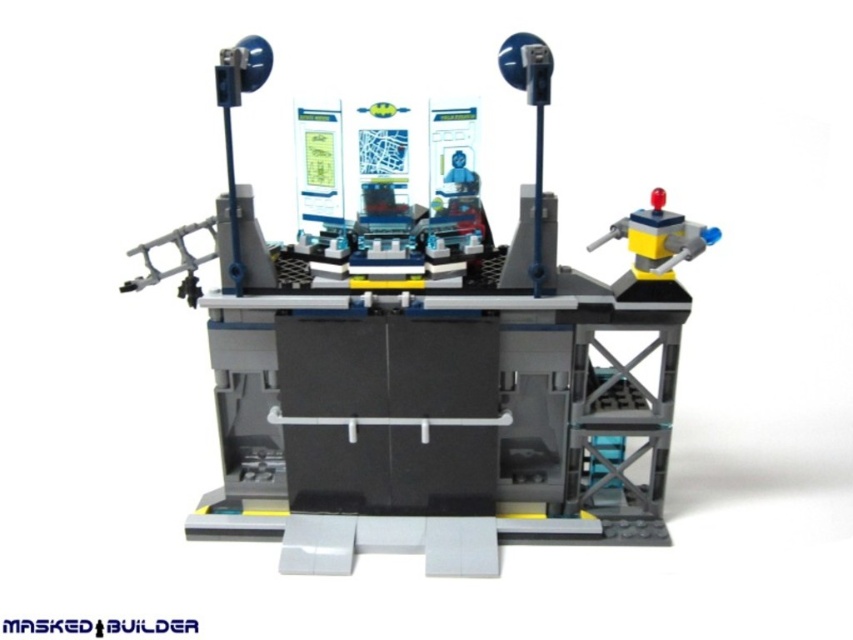
Question: Is matte gray robot at upper right wider than yellow plastic robot at upper right?

Choices:
 (A) yes
 (B) no

Answer: (A)

Question: Which object is farther from the camera taking this photo?

Choices:
 (A) yellow plastic robot at upper right
 (B) matte gray robot at upper right

Answer: (A)

Question: Which point appears closest to the camera in this image?

Choices:
 (A) (697, 230)
 (B) (561, 330)

Answer: (A)

Question: Does matte gray robot at upper right appear under yellow plastic robot at upper right?

Choices:
 (A) no
 (B) yes

Answer: (B)

Question: Does matte gray robot at upper right appear on the left side of yellow plastic robot at upper right?

Choices:
 (A) no
 (B) yes

Answer: (B)